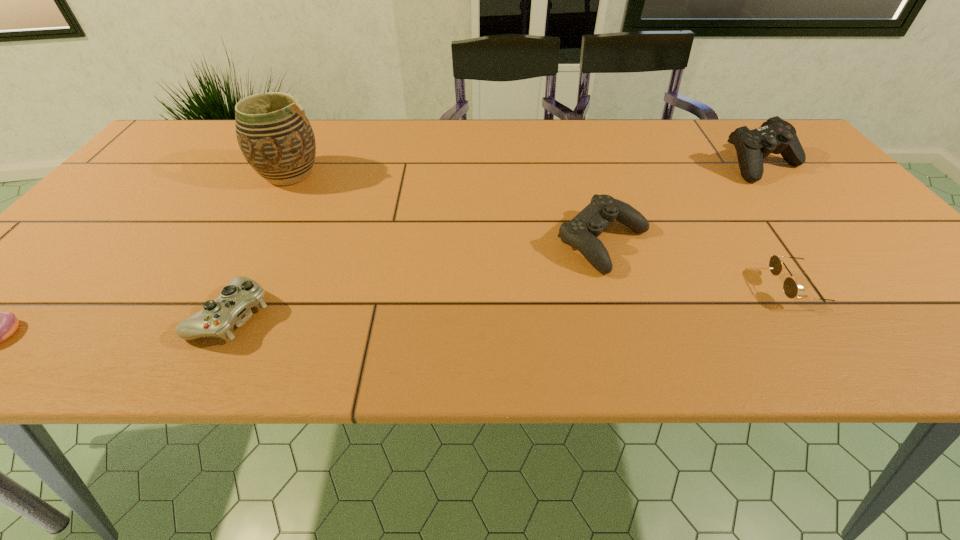
Find the location of a particular element. This screenshot has width=960, height=540. free spot located on the back of the nearest control is located at coordinates (285, 208).

Locate an element on the screen. This screenshot has height=540, width=960. vacant space located 0.130m on the front lenses of the sunglasses is located at coordinates (708, 289).

The width and height of the screenshot is (960, 540). What are the coordinates of `vacant region located 0.390m on the front lenses of the sunglasses` in the screenshot? It's located at (575, 289).

Identify the location of vacant space located on the front lenses of the sunglasses. (x=703, y=289).

Where is `pottery located in the far edge section of the desktop`? The height and width of the screenshot is (540, 960). pottery located in the far edge section of the desktop is located at coordinates (276, 138).

What are the coordinates of `control located at the far edge` in the screenshot? It's located at [x=776, y=136].

I want to click on object present at the near edge, so click(x=231, y=308).

Image resolution: width=960 pixels, height=540 pixels. I want to click on object that is positioned at the right edge, so click(776, 136).

The image size is (960, 540). Identify the location of object that is at the far right corner. (776, 136).

Identify the location of free space at the far edge of the desktop. (549, 120).